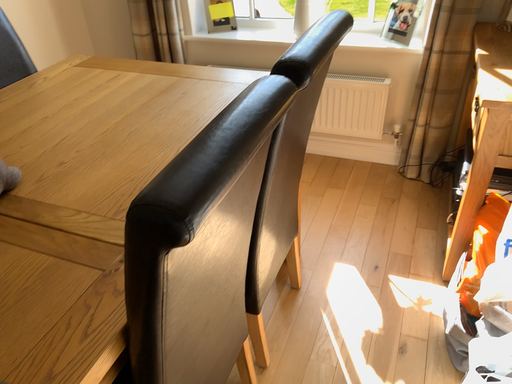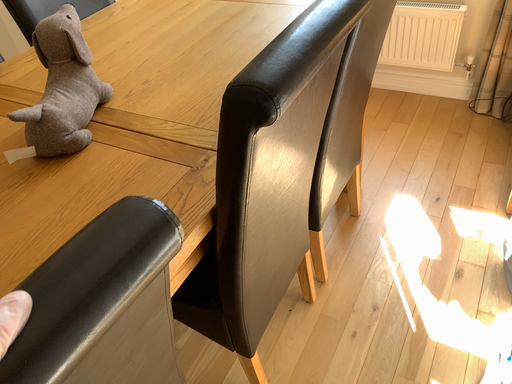
Question: Which way did the camera rotate in the video?

Choices:
 (A) rotated right
 (B) rotated left

Answer: (B)